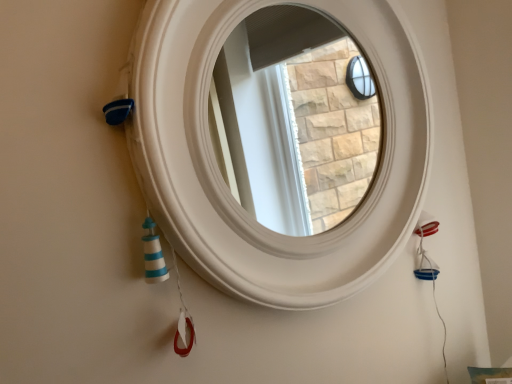
Where is `white matte window frame at center`? white matte window frame at center is located at coordinates (222, 177).

What do you see at coordinates (222, 177) in the screenshot?
I see `white matte window frame at center` at bounding box center [222, 177].

Measure the distance between white matte window frame at center and camera.

white matte window frame at center and camera are 22.12 inches apart.

The image size is (512, 384). In order to click on white matte window frame at center in this screenshot , I will do `click(222, 177)`.